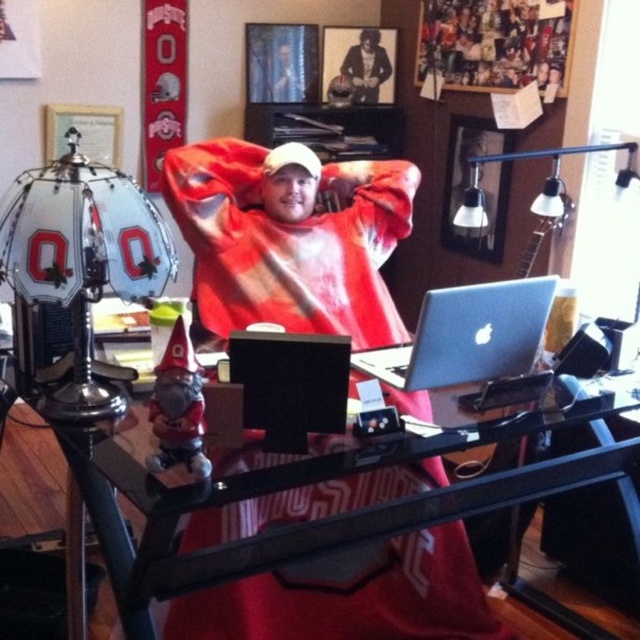
You are organizing a closet and need to decide which item takes up more horizontal space. Which one is wider, the red cotton shirt at center or the shiny black leather jacket at upper center?

The red cotton shirt at center is wider than the shiny black leather jacket at upper center according to the description.

You are standing in the home office and want to place a new plant between the two points, point (355,308) and point (362,77). Based on their positions, which point should the plant be closer to in order to be in front of the other point?

The plant should be closer to point (355,308) because it is in front of point (362,77).

You are a delivery robot with a package that is 25 inches long. You need to place the package between the red cotton shirt at center and the silver metallic laptop at center on the desk. Is there enough space to fit the package between them?

The distance between the red cotton shirt at center and the silver metallic laptop at center is 24.87 inches. Since the package is 25 inches long, it will not fit between them as the space is slightly smaller than the package.